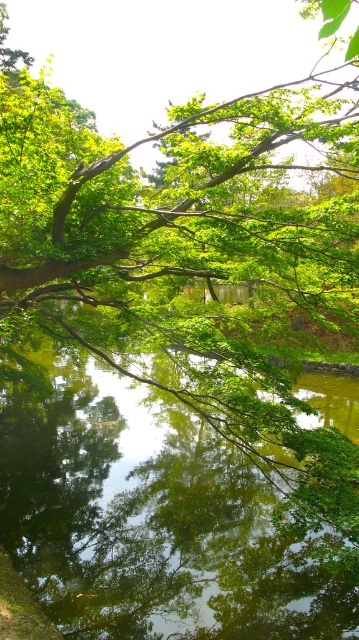
Question: Which of the following is the farthest from the observer?

Choices:
 (A) (x=179, y=563)
 (B) (x=137, y=145)

Answer: (B)

Question: Is green leafy branch at upper center to the right of green reflective water at center from the viewer's perspective?

Choices:
 (A) no
 (B) yes

Answer: (A)

Question: Which object is farther from the camera taking this photo?

Choices:
 (A) green leafy branch at upper center
 (B) green reflective water at center

Answer: (B)

Question: Does green leafy branch at upper center have a smaller size compared to green reflective water at center?

Choices:
 (A) yes
 (B) no

Answer: (B)

Question: Which point is farther from the camera taking this photo?

Choices:
 (A) (138, 435)
 (B) (164, 308)

Answer: (A)

Question: Can you confirm if green leafy branch at upper center is positioned below green reflective water at center?

Choices:
 (A) yes
 (B) no

Answer: (B)